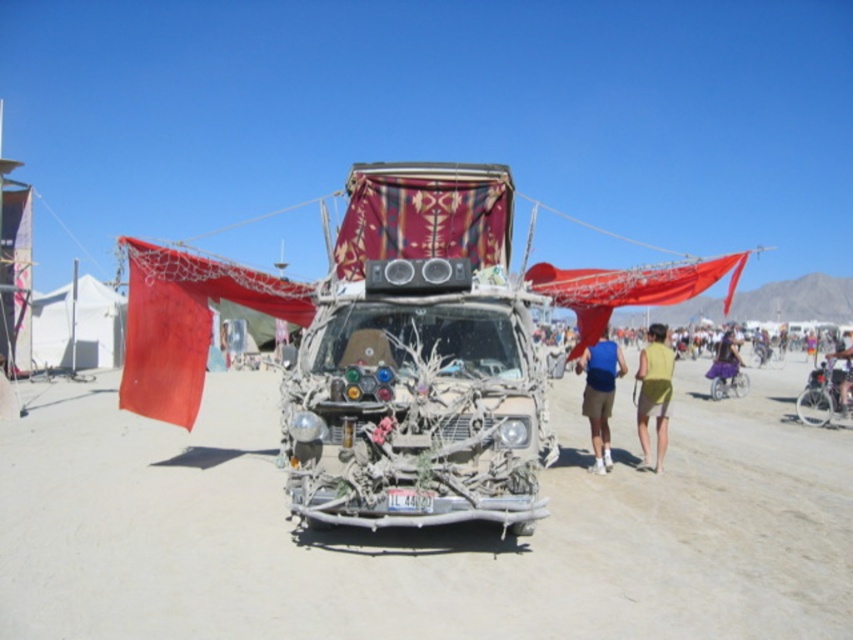
Question: Does dirt field at center come behind purple fabric skirt at right?

Choices:
 (A) no
 (B) yes

Answer: (A)

Question: Which object is the closest to the dirt field at center?

Choices:
 (A) purple fabric skirt at right
 (B) decorative wood van at center
 (C) blue fabric shorts at center

Answer: (B)

Question: Which point appears closest to the camera in this image?

Choices:
 (A) (839, 392)
 (B) (732, 349)

Answer: (A)

Question: Based on their relative distances, which object is nearer to the metallic silver bicycle at lower right?

Choices:
 (A) purple fabric skirt at right
 (B) green fabric shorts at lower right

Answer: (A)

Question: From the image, what is the correct spatial relationship of metallic silver bicycle at center-right in relation to green fabric bicycle at lower right?

Choices:
 (A) right
 (B) left

Answer: (B)

Question: Is green fabric shorts at lower right closer to camera compared to green fabric bicycle at lower right?

Choices:
 (A) yes
 (B) no

Answer: (A)